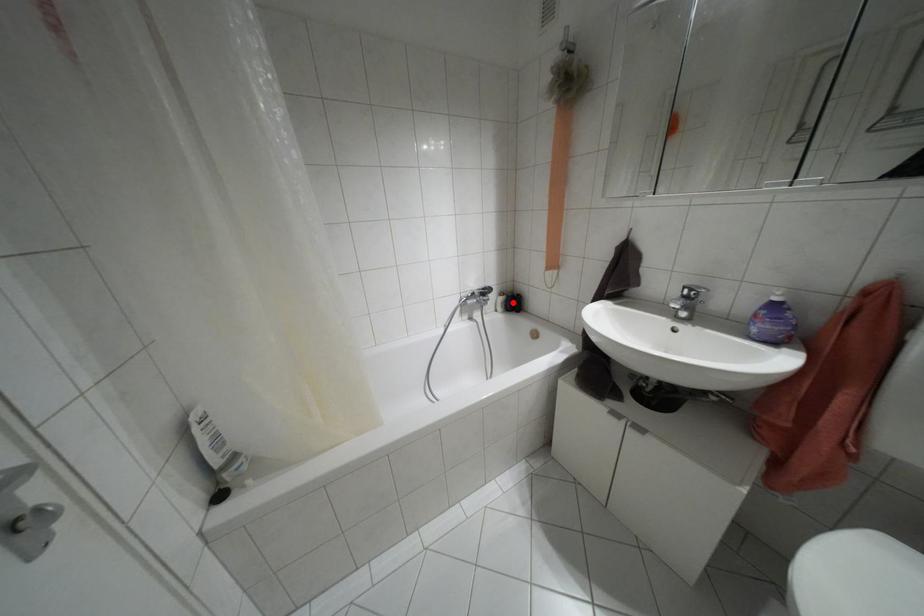
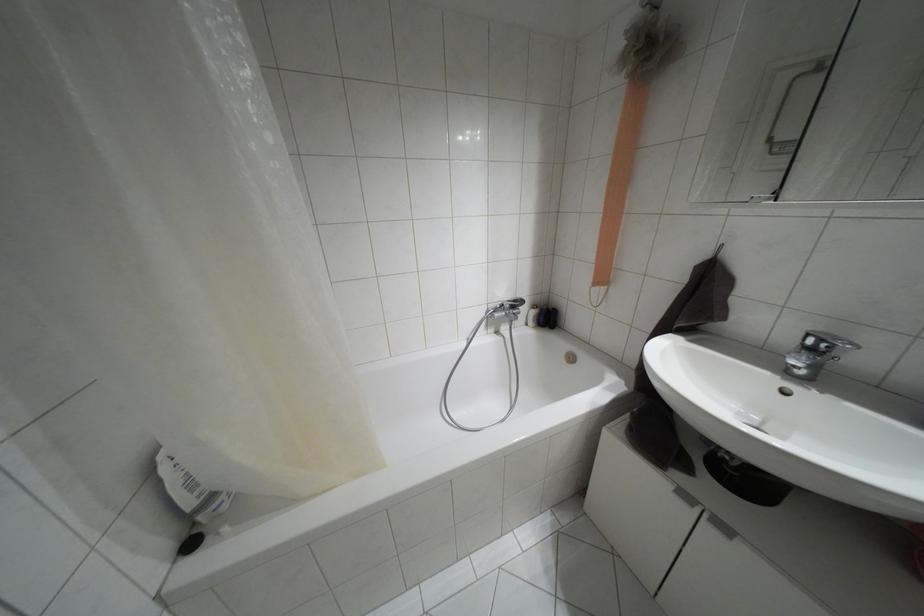
Question: I am providing you with two images of the same scene from different viewpoints. A red point is shown in image1. For the corresponding object point in image2, is it positioned nearer or farther from the camera?

Choices:
 (A) Nearer
 (B) Farther

Answer: (B)